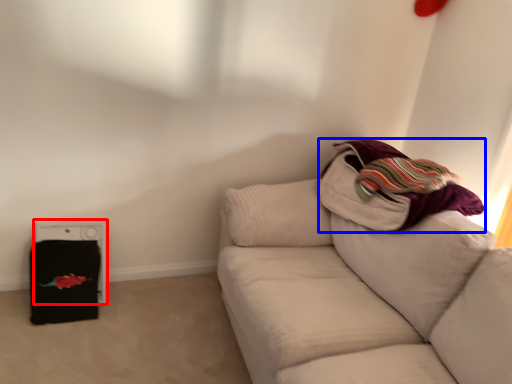
Question: Which object appears closest to the camera in this image, appliance (highlighted by a red box) or blanket (highlighted by a blue box)?

Choices:
 (A) appliance
 (B) blanket

Answer: (B)